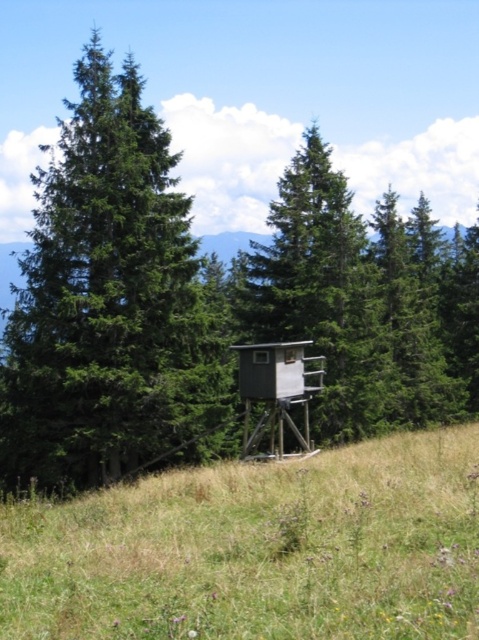
The width and height of the screenshot is (479, 640). What do you see at coordinates (110, 305) in the screenshot? I see `green matte tree at left` at bounding box center [110, 305].

Find the location of a particular element. The height and width of the screenshot is (640, 479). green matte tree at left is located at coordinates (110, 305).

In the scene shown: Which is above, green matte tree at center or green matte tree at left?

Positioned higher is green matte tree at center.

Locate an element on the screen. The width and height of the screenshot is (479, 640). green matte tree at center is located at coordinates (212, 305).

Which is in front, point (376, 314) or point (132, 179)?

Point (132, 179)

At what (x,y) coordinates should I click in order to perform the action: click on green matte tree at center. Please return your answer as a coordinate pair (x, y). This screenshot has height=640, width=479. Looking at the image, I should click on (212, 305).

Measure the distance from green matte tree at center to green grassy at center.

green matte tree at center and green grassy at center are 14.38 meters apart.

Between green matte tree at center and green grassy at center, which one has more height?

green matte tree at center

Between point (83, 189) and point (230, 547), which one is positioned behind?

The point (83, 189) is behind.

Find the location of `green matte tree at center`. green matte tree at center is located at coordinates (212, 305).